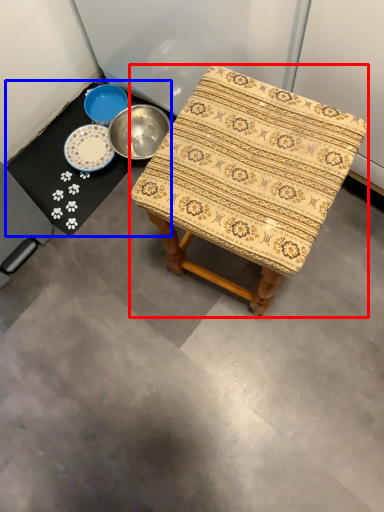
Question: Which of the following is the closest to the observer, stool (highlighted by a red box) or round table (highlighted by a blue box)?

Choices:
 (A) stool
 (B) round table

Answer: (A)